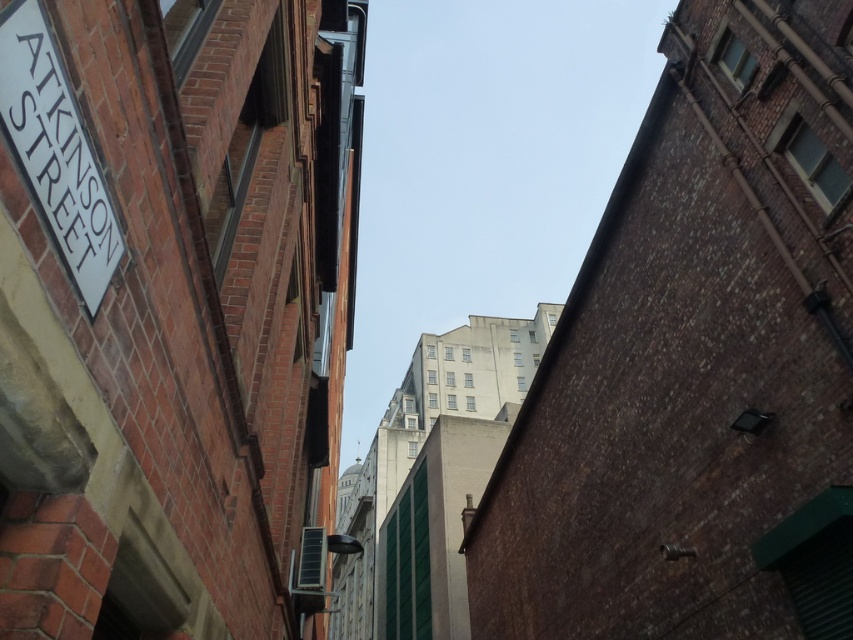
You are navigating through the alleyway and need to reach a destination located at the position of point (96, 289). There is an obstacle at point (683, 237). Based on the alleyway layout, can you safely pass around the obstacle to reach your destination?

Point (683, 237) is behind point (96, 289), so you can safely navigate around the obstacle at point (683, 237) to reach your destination at point (96, 289) since the obstacle is located behind your destination and not blocking the path.

You are standing in the alleyway and need to locate the street sign. According to the image, where is the brown brick wall at upper center in relation to the white plastic street sign at upper left?

The brown brick wall at upper center is to the right of the white plastic street sign at upper left.